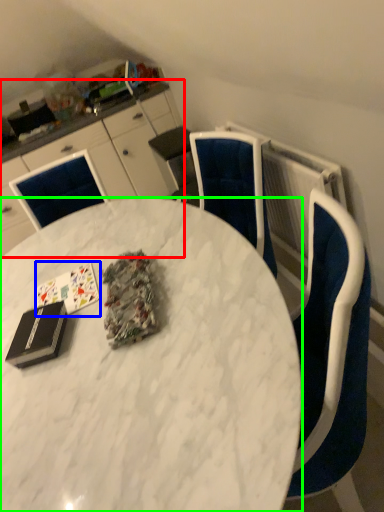
Question: Which is farther away from cabinetry (highlighted by a red box)? card game (highlighted by a blue box) or desk (highlighted by a green box)?

Choices:
 (A) card game
 (B) desk

Answer: (A)